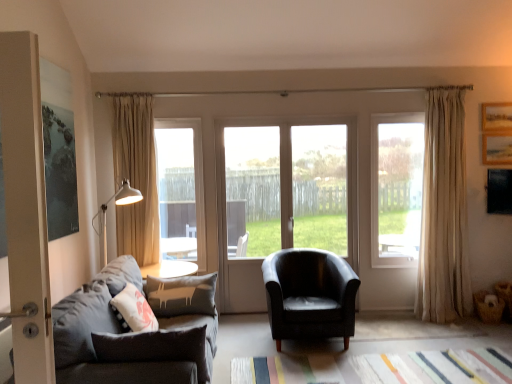
Where is `blank space situated above transparent glass door at center, which ranks as the second window in right-to-left order (from a real-world perspective)`? The width and height of the screenshot is (512, 384). blank space situated above transparent glass door at center, which ranks as the second window in right-to-left order (from a real-world perspective) is located at coordinates (286, 117).